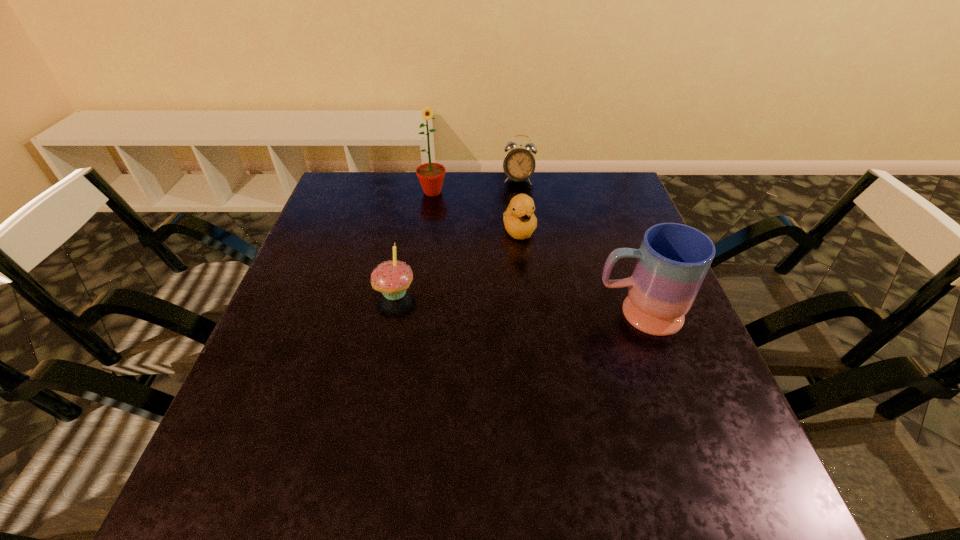
Locate an element on the screen. duckling that is at the far edge is located at coordinates (519, 219).

Identify the location of alarm clock present at the far edge. click(x=519, y=164).

You are a GUI agent. You are given a task and a screenshot of the screen. Output one action in this format:
    pyautogui.click(x=<x>, y=<y>)
    Task: Click on the object that is at the right edge
    This screenshot has height=540, width=960.
    Given the screenshot: What is the action you would take?
    pyautogui.click(x=673, y=259)

This screenshot has height=540, width=960. I want to click on blank space at the far edge of the desktop, so click(550, 178).

You are a GUI agent. You are given a task and a screenshot of the screen. Output one action in this format:
    pyautogui.click(x=<x>, y=<y>)
    Task: Click on the vacant space at the near edge
    The image size is (960, 540).
    Given the screenshot: What is the action you would take?
    pyautogui.click(x=333, y=434)

You are a GUI agent. You are given a task and a screenshot of the screen. Output one action in this format:
    pyautogui.click(x=<x>, y=<y>)
    Task: Click on the blank space at the left edge of the desktop
    This screenshot has height=540, width=960.
    Given the screenshot: What is the action you would take?
    pyautogui.click(x=318, y=341)

Identify the location of blank area at the right edge. The width and height of the screenshot is (960, 540). coord(635,259).

The width and height of the screenshot is (960, 540). Identify the location of vacant space at the far left corner of the desktop. (344, 172).

Find the location of a particular element. blank area at the far right corner is located at coordinates (578, 187).

Find the location of a particular element. This screenshot has width=960, height=540. free space that is in between the third farthest object and the rightmost object is located at coordinates (579, 272).